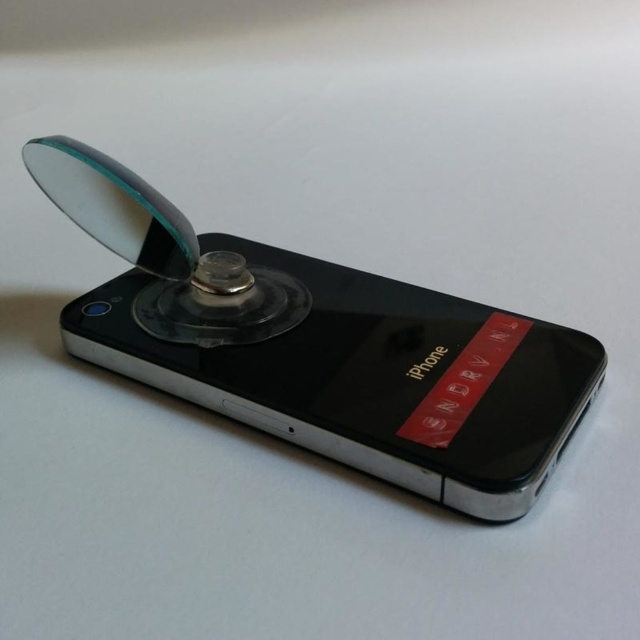
You are trying to place a small sticker on the back of the black glossy iPhone at center. The sticker is 3 cm wide. Can the transparent plastic magnifying glass at upper center fit on the sticker if placed directly on top?

The black glossy iPhone at center is much taller than the transparent plastic magnifying glass at upper center, so the magnifying glass can fit on the sticker placed on the iPhone.

You are trying to inspect the screen of the black glossy iPhone at center using the transparent plastic magnifying glass at upper center. Is the magnifying glass placed directly over the iPhone screen?

The black glossy iPhone at center is positioned under the transparent plastic magnifying glass at upper center, so yes, the magnifying glass is placed directly over the iPhone screen.